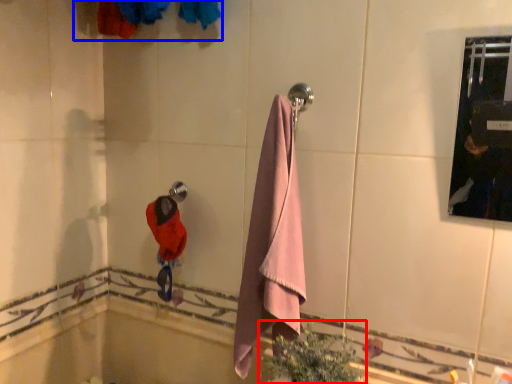
Question: Which object is closer to the camera taking this photo, plant (highlighted by a red box) or laundry (highlighted by a blue box)?

Choices:
 (A) plant
 (B) laundry

Answer: (B)